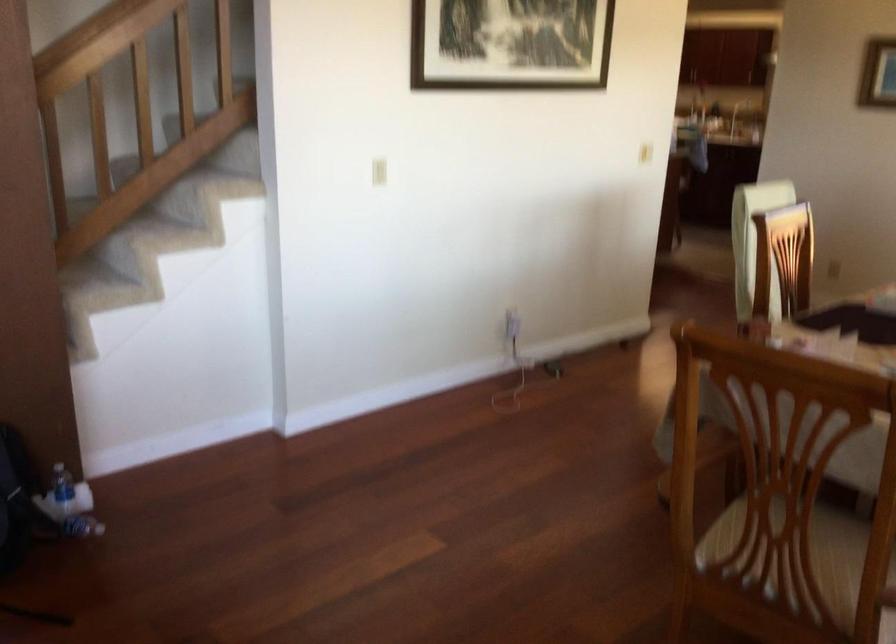
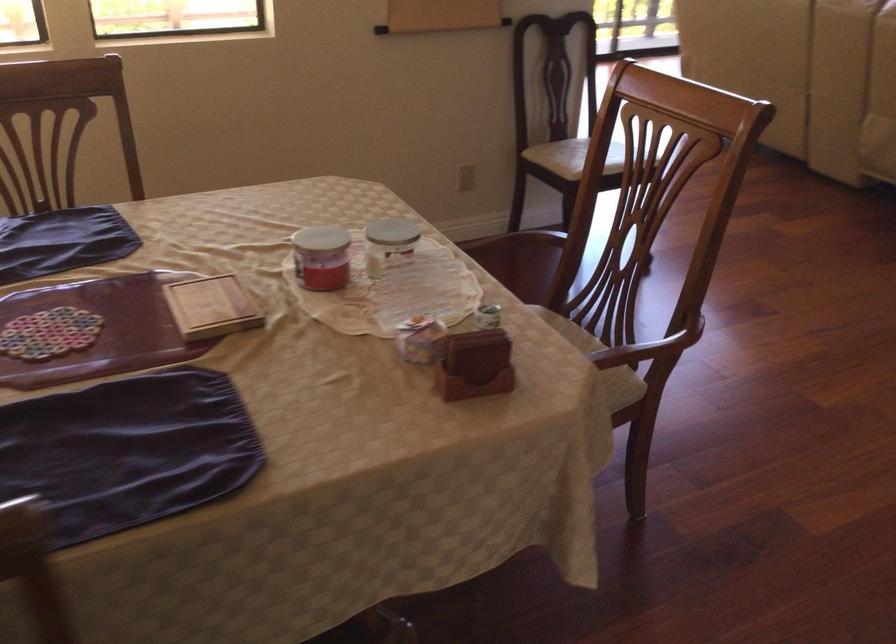
The point at (747, 327) is marked in the first image. Where is the corresponding point in the second image?

(475, 365)